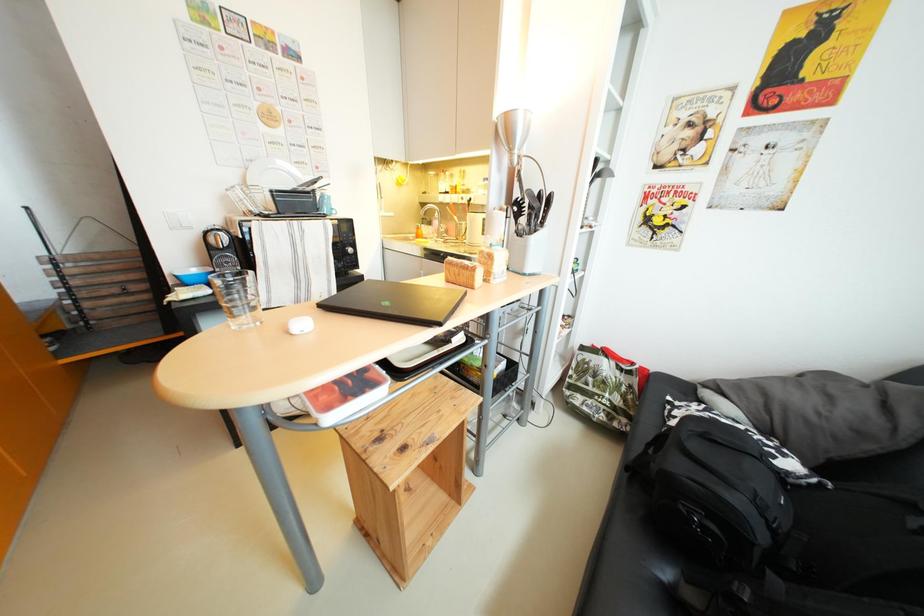
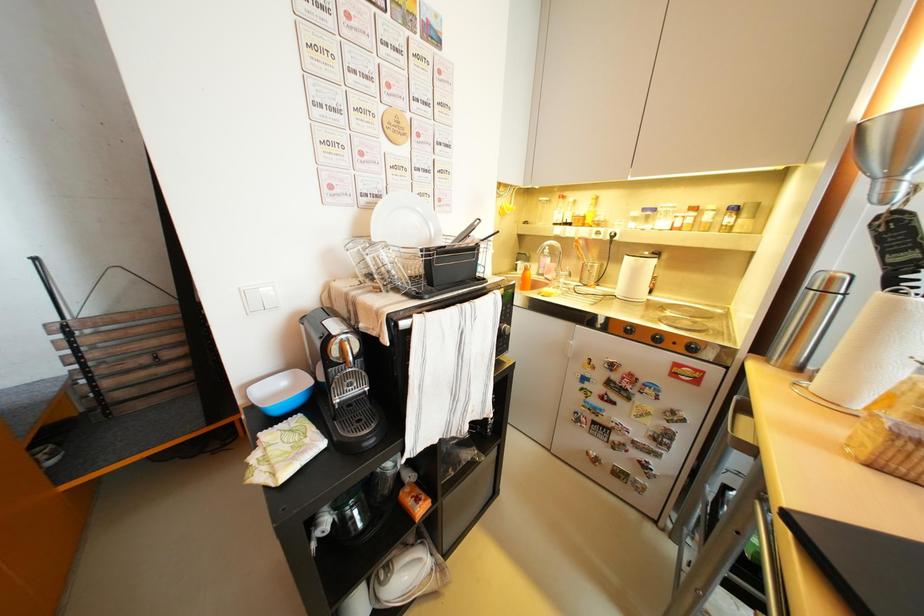
Question: The first image is from the beginning of the video and the second image is from the end. How did the camera likely rotate when shooting the video?

Choices:
 (A) Left
 (B) Right
 (C) Up
 (D) Down

Answer: (C)